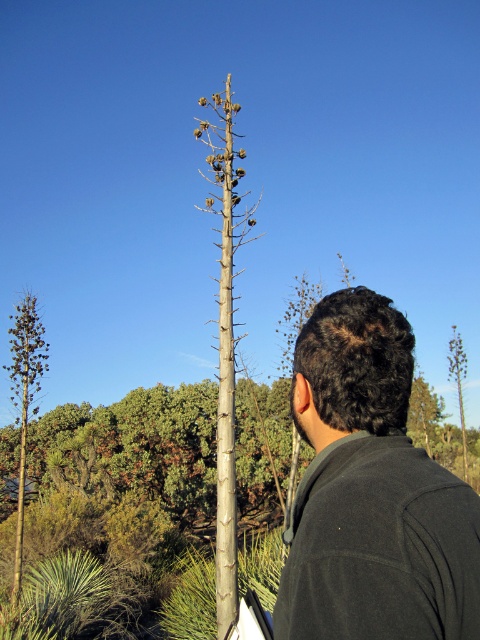
Question: Estimate the real-world distances between objects in this image. Which object is farther from the green leafy tree at left?

Choices:
 (A) bare wood tree at center
 (B) green leafy tree at right
 (C) dark gray/black fabric at center

Answer: (B)

Question: Does bare wood tree at center appear on the right side of green leafy tree at right?

Choices:
 (A) no
 (B) yes

Answer: (A)

Question: Based on their relative distances, which object is nearer to the green leafy tree at left?

Choices:
 (A) green leafy tree at right
 (B) dark gray/black fabric at center
 (C) bare wood tree at center

Answer: (C)

Question: Can you confirm if dark gray/black fabric at center is positioned above bare wood tree at center?

Choices:
 (A) no
 (B) yes

Answer: (B)

Question: Is green leafy tree at left below green leafy tree at right?

Choices:
 (A) no
 (B) yes

Answer: (A)

Question: Which point is farther to the camera?

Choices:
 (A) dark gray/black fabric at center
 (B) bare wood tree at center
 (C) green leafy tree at right
 (D) green leafy tree at left

Answer: (C)